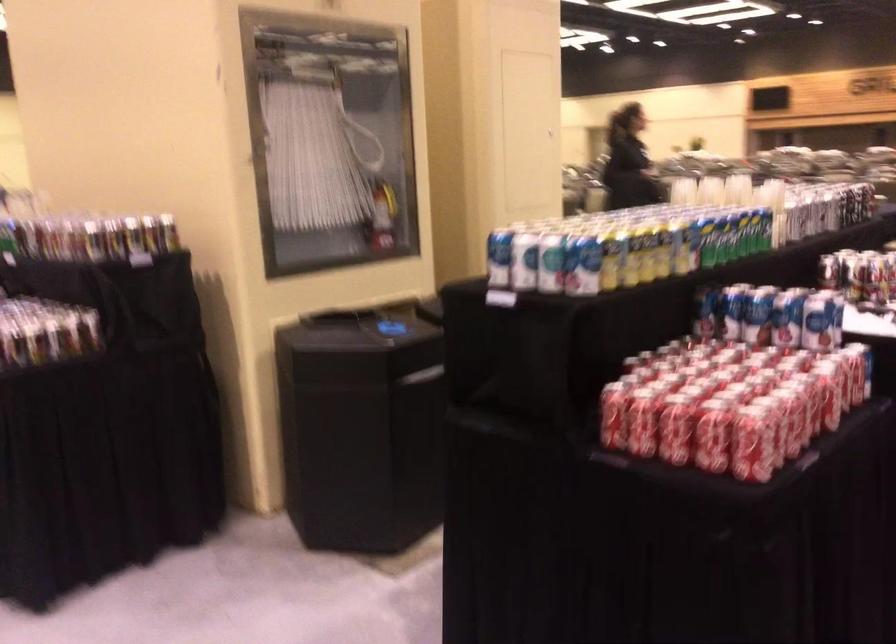
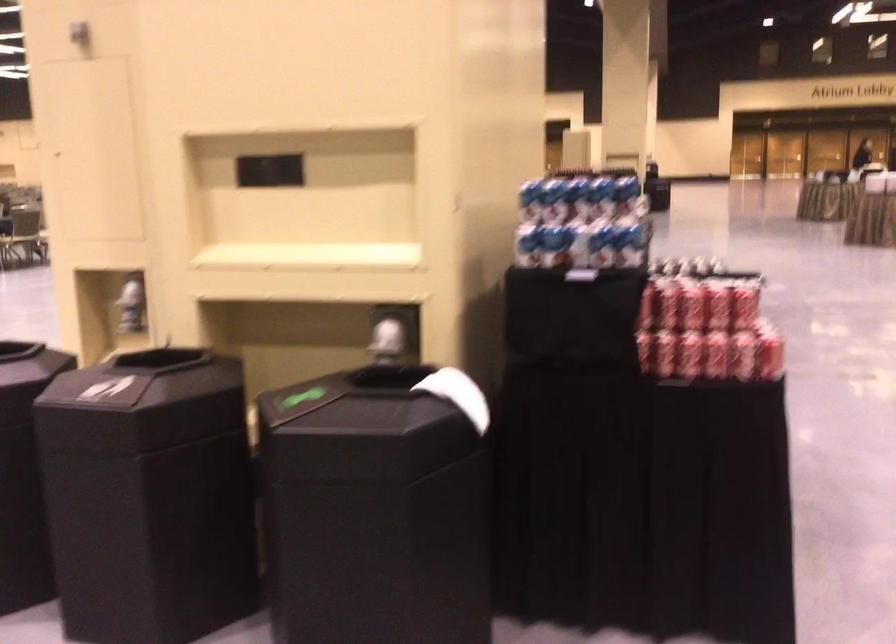
Question: I am providing you with two images of the same scene from different viewpoints. Which of the following objects are not visible in image2?

Choices:
 (A) metal cart
 (B) red soda can
 (C) white paper towel
 (D) blue and white can

Answer: (D)